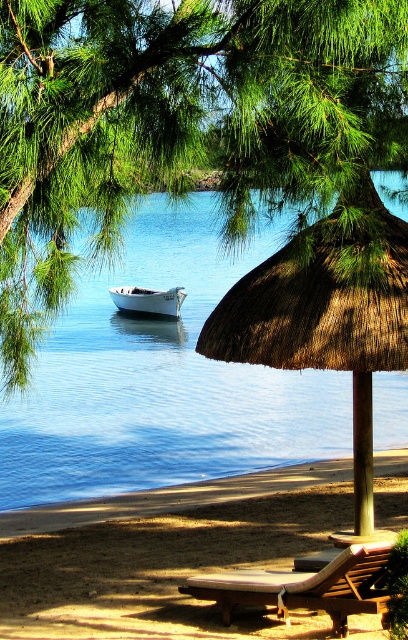
Question: Is blue water at center to the left of white matte boat at center from the viewer's perspective?

Choices:
 (A) yes
 (B) no

Answer: (B)

Question: Does brown sandy beach at lower center have a larger size compared to white matte boat at center?

Choices:
 (A) yes
 (B) no

Answer: (B)

Question: Which point appears farthest from the camera in this image?

Choices:
 (A) (146, 301)
 (B) (62, 200)
 (C) (263, 580)

Answer: (A)

Question: Based on their relative distances, which object is nearer to the brown sandy beach at lower center?

Choices:
 (A) wooden textured lounge chair at lower center
 (B) green leafy tree at upper left

Answer: (A)

Question: Based on their relative distances, which object is nearer to the green leafy tree at upper left?

Choices:
 (A) wooden textured lounge chair at lower center
 (B) brown/thatched umbrella at center
 (C) blue water at center
 (D) brown sandy beach at lower center

Answer: (B)

Question: Does blue water at center have a lesser width compared to brown/thatched umbrella at center?

Choices:
 (A) no
 (B) yes

Answer: (A)